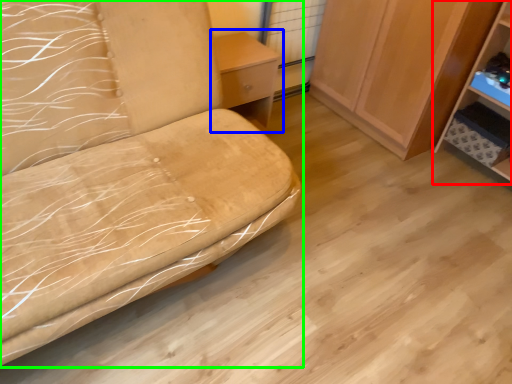
Question: Estimate the real-world distances between objects in this image. Which object is closer to shelf (highlighted by a red box), table (highlighted by a blue box) or furniture (highlighted by a green box)?

Choices:
 (A) table
 (B) furniture

Answer: (A)